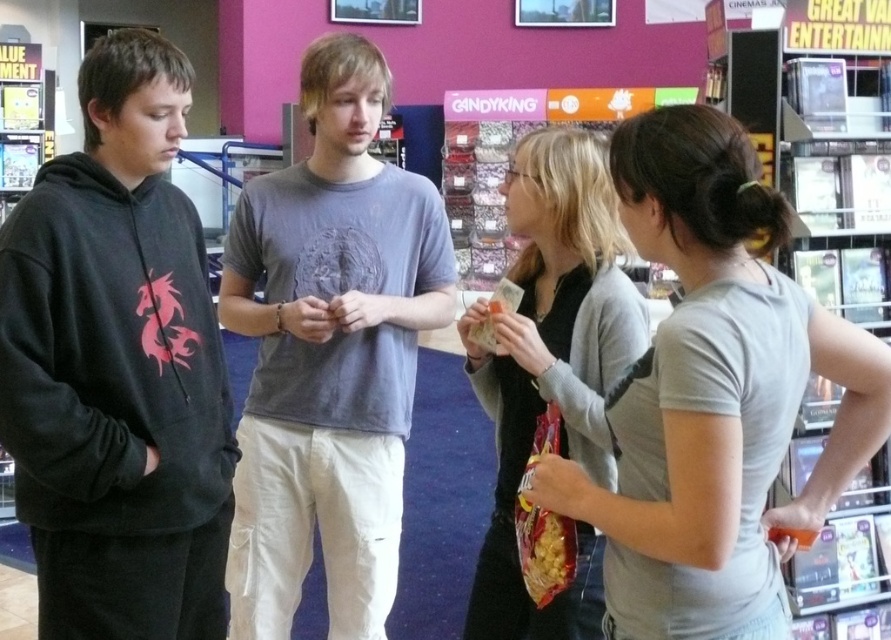
Does gray cotton t-shirt at center appear under black matte cardigan at center?

No, gray cotton t-shirt at center is not below black matte cardigan at center.

Does gray cotton t-shirt at center have a greater height compared to black matte cardigan at center?

Yes, gray cotton t-shirt at center is taller than black matte cardigan at center.

Between point (375, 422) and point (620, 320), which one is positioned behind?

Point (375, 422)

This screenshot has height=640, width=891. What are the coordinates of `gray cotton t-shirt at center` in the screenshot? It's located at (329, 353).

Does gray matte t-shirt at center have a larger size compared to black matte cardigan at center?

Actually, gray matte t-shirt at center might be smaller than black matte cardigan at center.

Describe the element at coordinates (714, 396) in the screenshot. I see `gray matte t-shirt at center` at that location.

Is point (734, 589) positioned behind point (532, 211)?

No.

Find the location of `gray matte t-shirt at center`. gray matte t-shirt at center is located at coordinates pos(714,396).

Who is positioned more to the left, gray matte t-shirt at center or gray cotton t-shirt at center?

gray cotton t-shirt at center

Does gray matte t-shirt at center appear on the right side of gray cotton t-shirt at center?

Correct, you'll find gray matte t-shirt at center to the right of gray cotton t-shirt at center.

Is point (718, 124) positioned before point (347, 168)?

Yes, point (718, 124) is in front of point (347, 168).

Identify the location of gray matte t-shirt at center. (714, 396).